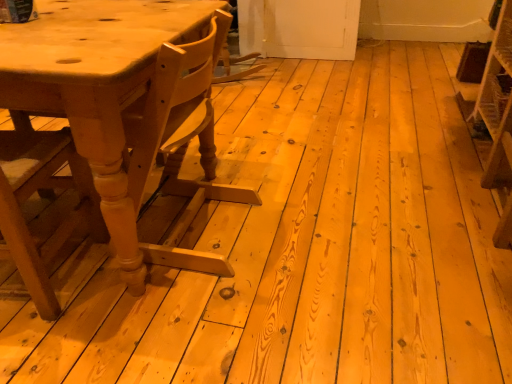
Question: Is wooden chair at left at the left side of wooden crate at right?

Choices:
 (A) yes
 (B) no

Answer: (A)

Question: Can you confirm if wooden chair at left is bigger than wooden crate at right?

Choices:
 (A) no
 (B) yes

Answer: (B)

Question: From the image's perspective, is wooden chair at left above wooden crate at right?

Choices:
 (A) no
 (B) yes

Answer: (A)

Question: Can you confirm if wooden chair at left is wider than wooden crate at right?

Choices:
 (A) yes
 (B) no

Answer: (A)

Question: Considering the relative sizes of wooden chair at left and wooden crate at right in the image provided, is wooden chair at left taller than wooden crate at right?

Choices:
 (A) no
 (B) yes

Answer: (B)

Question: Considering the relative positions of wooden chair at left and wooden crate at right in the image provided, is wooden chair at left to the right of wooden crate at right from the viewer's perspective?

Choices:
 (A) no
 (B) yes

Answer: (A)

Question: From the image's perspective, does wooden crate at right appear higher than wooden chair at left?

Choices:
 (A) yes
 (B) no

Answer: (A)

Question: Is wooden crate at right not within wooden chair at left?

Choices:
 (A) no
 (B) yes

Answer: (B)

Question: Can you confirm if wooden crate at right is positioned to the right of wooden chair at left?

Choices:
 (A) yes
 (B) no

Answer: (A)

Question: Can you confirm if wooden crate at right is bigger than wooden chair at left?

Choices:
 (A) yes
 (B) no

Answer: (B)

Question: Can you confirm if wooden crate at right is shorter than wooden chair at left?

Choices:
 (A) yes
 (B) no

Answer: (A)

Question: Considering the relative positions of wooden crate at right and wooden chair at left in the image provided, is wooden crate at right in front of wooden chair at left?

Choices:
 (A) no
 (B) yes

Answer: (A)

Question: Is wooden crate at right thinner than light brown wood table at left?

Choices:
 (A) yes
 (B) no

Answer: (A)